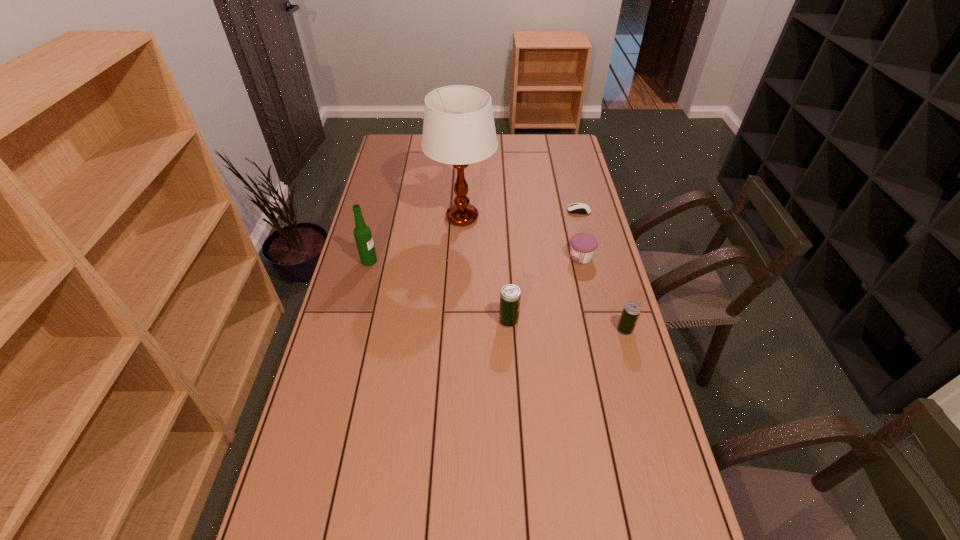
All beer cans are currently evenly spaced. To continue this pattern, where would you add another beer can on the left? Please point out a vacant spot. Please provide its 2D coordinates. Your answer should be formatted as a tuple, i.e. [(x, y)], where the tuple contains the x and y coordinates of a point satisfying the conditions above.

[(396, 312)]